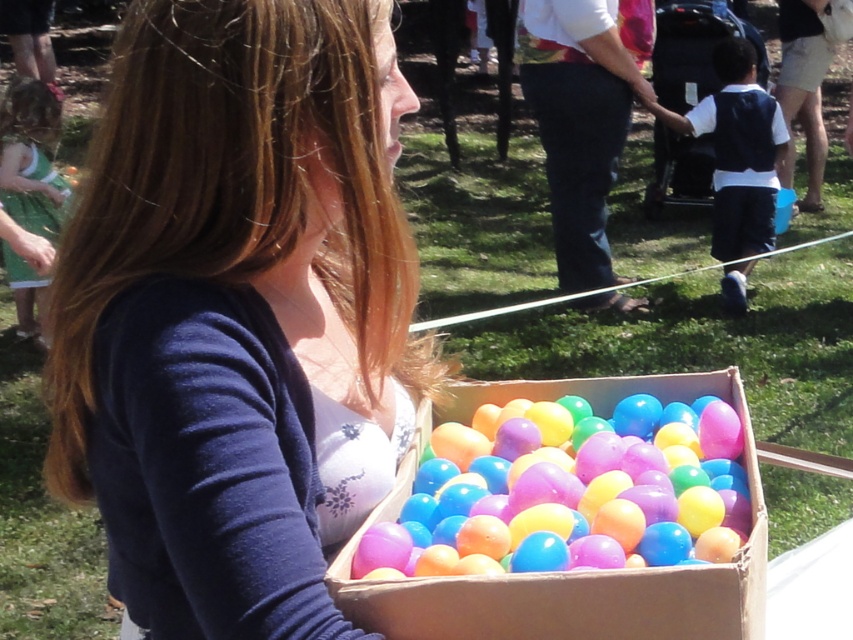
Which is in front, point (531, 516) or point (714, 225)?

Point (531, 516) is more forward.

Does point (566, 408) lie behind point (772, 145)?

That is False.

Locate an element on the screen. The image size is (853, 640). translucent plastic eggs at center is located at coordinates (569, 493).

Does white cotton shirt at right have a larger size compared to green cotton dress at left?

Yes, white cotton shirt at right is bigger than green cotton dress at left.

Between white cotton shirt at right and green cotton dress at left, which one is positioned higher?

white cotton shirt at right

Who is more distant from viewer, (776,150) or (25,301)?

Positioned behind is point (776,150).

Locate an element on the screen. white cotton shirt at right is located at coordinates (737, 150).

Who is taller, matte white tank top at center or green cotton dress at left?

With more height is green cotton dress at left.

Does matte white tank top at center have a lesser height compared to green cotton dress at left?

Correct, matte white tank top at center is not as tall as green cotton dress at left.

The height and width of the screenshot is (640, 853). I want to click on matte white tank top at center, so click(x=225, y=307).